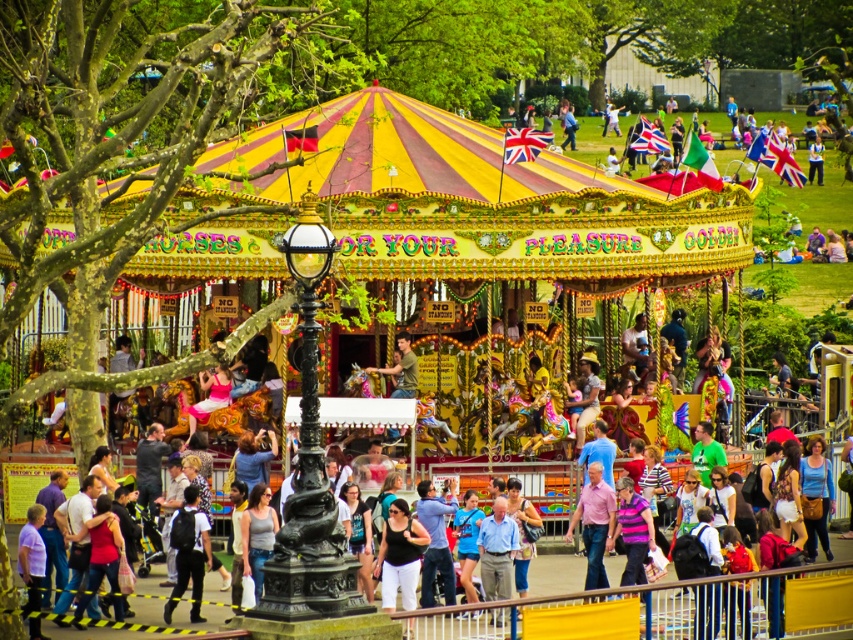
Question: In this image, where is dark blue backpack at center located relative to pink cotton shirt at center?

Choices:
 (A) below
 (B) above

Answer: (A)

Question: Is dark blue backpack at center further to the viewer compared to pink cotton shirt at center?

Choices:
 (A) no
 (B) yes

Answer: (A)

Question: Which point is closer to the camera taking this photo?

Choices:
 (A) (579, 513)
 (B) (196, 538)

Answer: (B)

Question: Is dark blue backpack at center further to the viewer compared to pink cotton shirt at center?

Choices:
 (A) yes
 (B) no

Answer: (B)